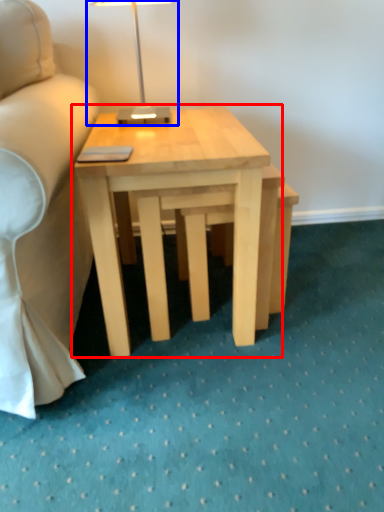
Question: Which of the following is the farthest to the observer, coffee table (highlighted by a red box) or table lamp (highlighted by a blue box)?

Choices:
 (A) coffee table
 (B) table lamp

Answer: (B)